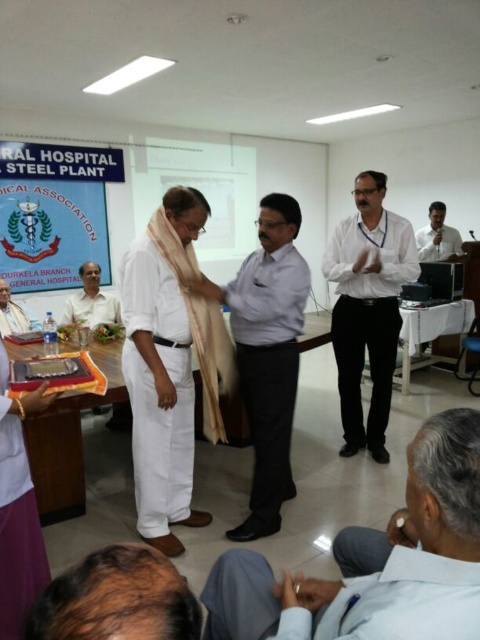
Question: Does white shirt at center have a smaller size compared to matte white shirt at center?

Choices:
 (A) no
 (B) yes

Answer: (A)

Question: Does white cloth at center appear over white shirt at center?

Choices:
 (A) no
 (B) yes

Answer: (A)

Question: Where is white cotton dhoti at center located in relation to white shirt at center in the image?

Choices:
 (A) below
 (B) above

Answer: (A)

Question: Estimate the real-world distances between objects in this image. Which object is closer to the white shirt at center?

Choices:
 (A) white cotton shirt at lower left
 (B) white cloth at center
 (C) white cotton dhoti at center

Answer: (B)

Question: Which of the following is the closest to the observer?

Choices:
 (A) white cloth at center
 (B) white cotton dhoti at center

Answer: (B)

Question: Which of these objects is positioned closest to the matte white shirt at center?

Choices:
 (A) light brown shirt at upper right
 (B) light blue cotton shirt at lower right

Answer: (B)